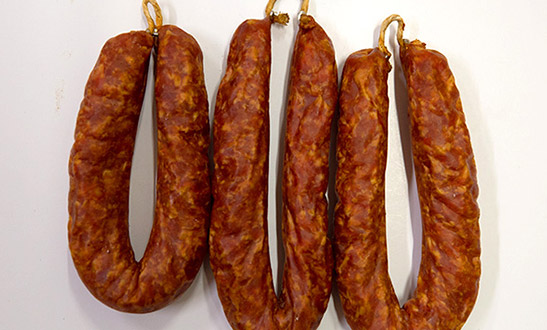
Where is `light`? The height and width of the screenshot is (330, 547). light is located at coordinates (493, 65).